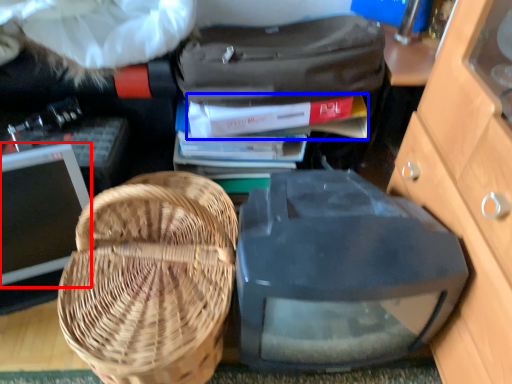
Question: Which point is further to the camera, computer monitor (highlighted by a red box) or book (highlighted by a blue box)?

Choices:
 (A) computer monitor
 (B) book

Answer: (B)